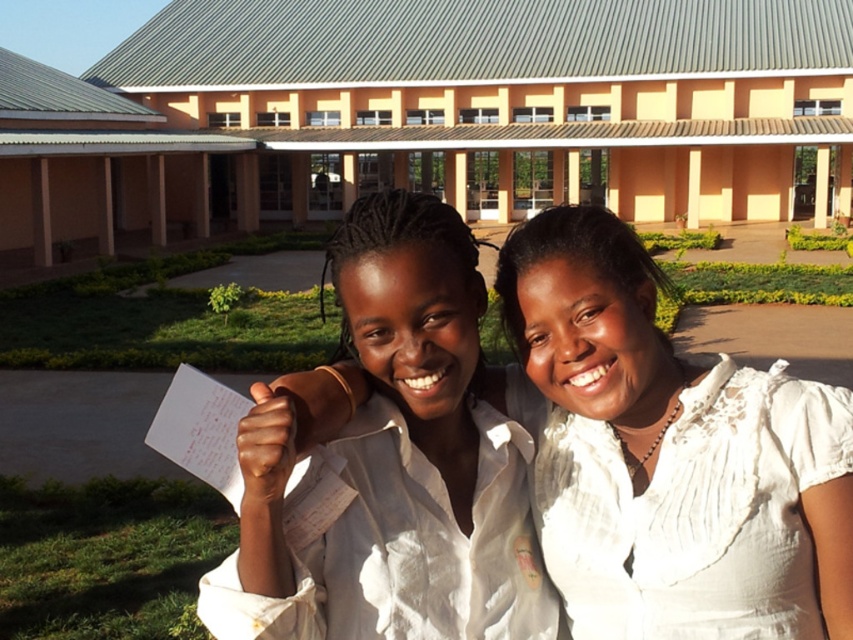
In the scene shown: You are a photographer taking a photo of two people wearing white cotton shirt at center and white pleated dress at center. Which one is positioned to the left?

The white cotton shirt at center is positioned to the left of the white pleated dress at center.

You are standing in front of the modern building and see the point marked at coordinates [395,461]. Which object is this point located on?

The point marked at coordinates [395,461] is located on the white cotton shirt at center.